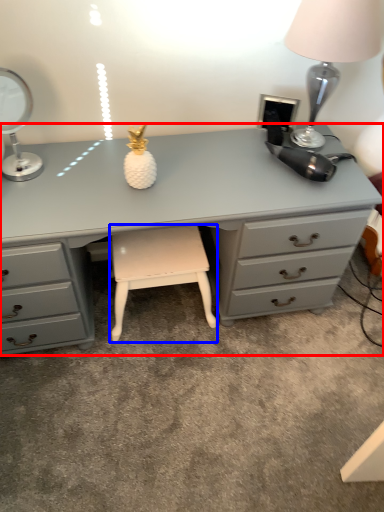
Question: Which object appears closest to the camera in this image, desk (highlighted by a red box) or stool (highlighted by a blue box)?

Choices:
 (A) desk
 (B) stool

Answer: (A)